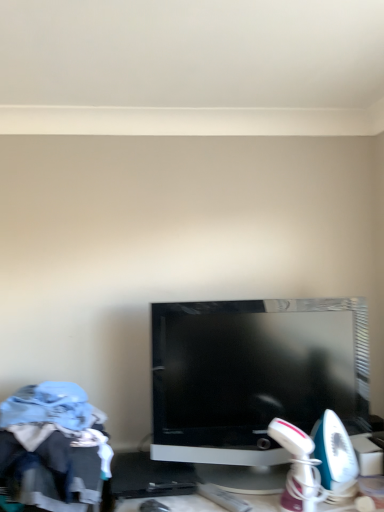
Question: Is black glossy television at center taller than light blue fabric at lower left?

Choices:
 (A) no
 (B) yes

Answer: (B)

Question: Is black glossy television at center outside light blue fabric at lower left?

Choices:
 (A) no
 (B) yes

Answer: (B)

Question: From a real-world perspective, is black glossy television at center physically above light blue fabric at lower left?

Choices:
 (A) no
 (B) yes

Answer: (B)

Question: Is black glossy television at center aimed at light blue fabric at lower left?

Choices:
 (A) yes
 (B) no

Answer: (B)

Question: Does black glossy television at center have a larger size compared to light blue fabric at lower left?

Choices:
 (A) yes
 (B) no

Answer: (A)

Question: Is black glossy television at center to the right of light blue fabric at lower left from the viewer's perspective?

Choices:
 (A) yes
 (B) no

Answer: (A)

Question: Does light blue fabric at lower left have a lesser width compared to black glossy television at center?

Choices:
 (A) no
 (B) yes

Answer: (A)

Question: Does light blue fabric at lower left have a greater height compared to black glossy television at center?

Choices:
 (A) yes
 (B) no

Answer: (B)

Question: Is light blue fabric at lower left outside black glossy television at center?

Choices:
 (A) no
 (B) yes

Answer: (B)

Question: Does light blue fabric at lower left turn towards black glossy television at center?

Choices:
 (A) no
 (B) yes

Answer: (A)

Question: Can you confirm if light blue fabric at lower left is smaller than black glossy television at center?

Choices:
 (A) yes
 (B) no

Answer: (A)

Question: Does light blue fabric at lower left have a larger size compared to black glossy television at center?

Choices:
 (A) no
 (B) yes

Answer: (A)

Question: Looking at their shapes, would you say black glossy television at center is wider or thinner than light blue fabric at lower left?

Choices:
 (A) wide
 (B) thin

Answer: (B)